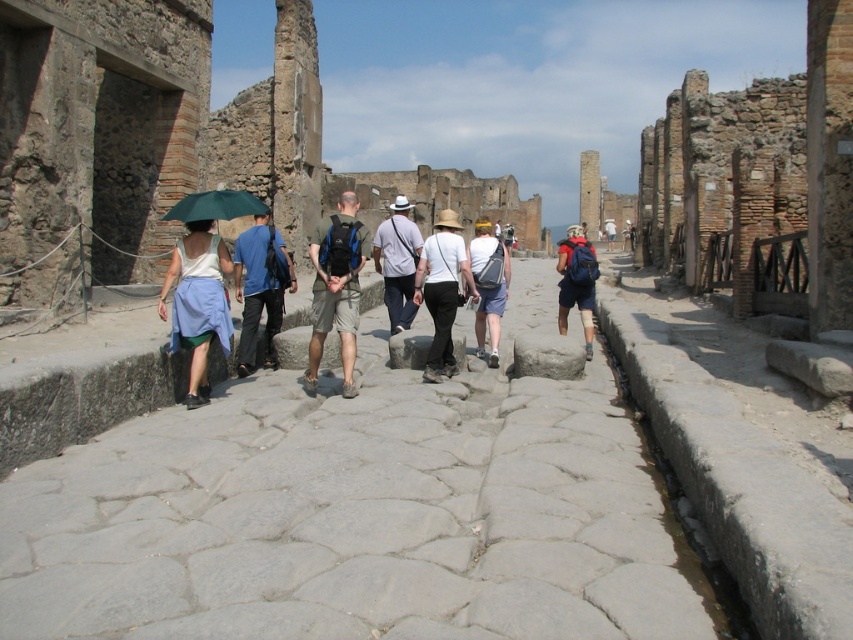
Does light blue fabric skirt at left have a lesser height compared to denim shorts at center?

No.

The height and width of the screenshot is (640, 853). Describe the element at coordinates (196, 301) in the screenshot. I see `light blue fabric skirt at left` at that location.

Image resolution: width=853 pixels, height=640 pixels. Find the location of `light blue fabric skirt at left`. light blue fabric skirt at left is located at coordinates (196, 301).

Does gray stone alley at center have a greater width compared to green fabric backpack at center?

Yes.

What do you see at coordinates (352, 516) in the screenshot? I see `gray stone alley at center` at bounding box center [352, 516].

Which is behind, point (18, 564) or point (328, 268)?

Positioned behind is point (328, 268).

Locate an element on the screen. Image resolution: width=853 pixels, height=640 pixels. gray stone alley at center is located at coordinates (352, 516).

Is point (389, 221) less distant than point (572, 225)?

Yes.

Measure the distance from light gray fabric hat at center to blue denim shorts at center.

light gray fabric hat at center is 52.25 feet from blue denim shorts at center.

Based on the photo, who is more forward, (416, 257) or (561, 253)?

Point (416, 257)

I want to click on light gray fabric hat at center, so click(x=397, y=262).